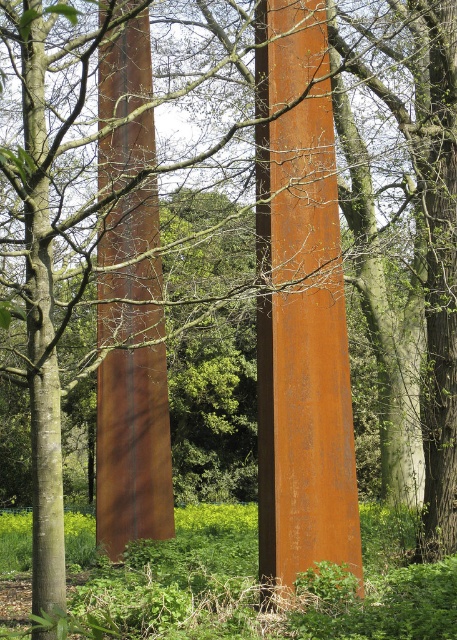
Between rusty metal pole at center and rusty metal pillar at center, which one is positioned lower?

rusty metal pillar at center

Does rusty metal pole at center have a greater height compared to rusty metal pillar at center?

Indeed, rusty metal pole at center has a greater height compared to rusty metal pillar at center.

Find the location of a particular element. rusty metal pole at center is located at coordinates (301, 305).

The width and height of the screenshot is (457, 640). Find the location of `rusty metal pole at center`. rusty metal pole at center is located at coordinates (301, 305).